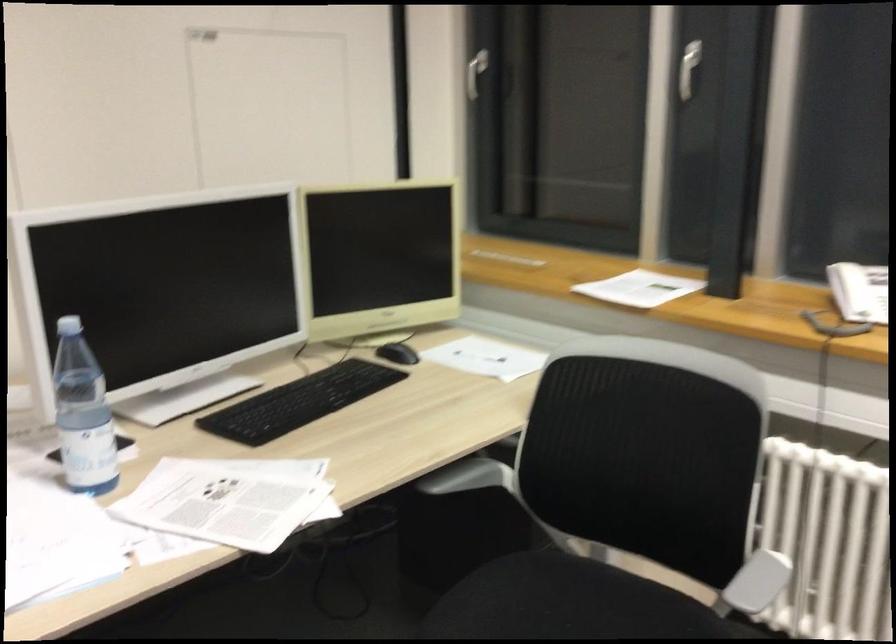
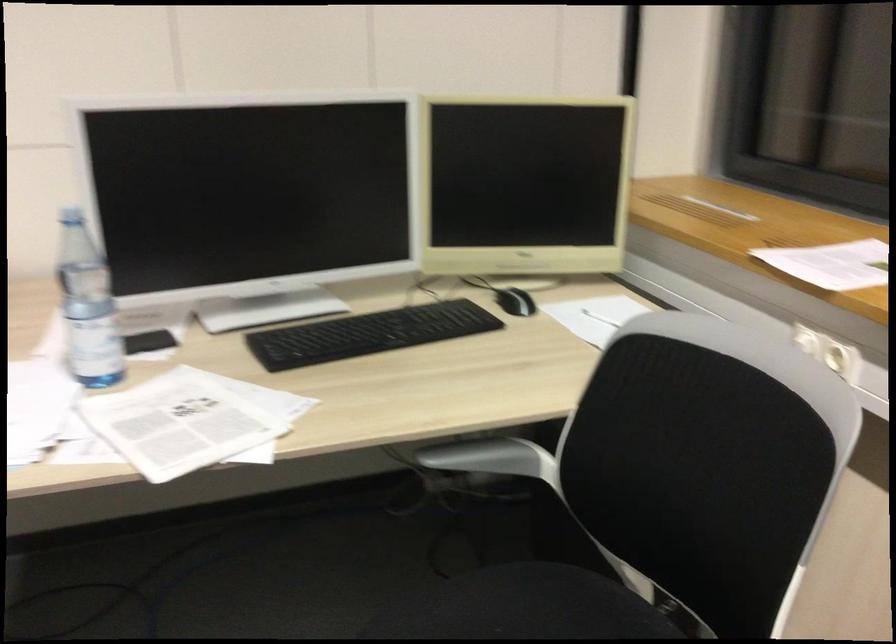
Question: The camera is either moving clockwise (left) or counter-clockwise (right) around the object. The first image is from the beginning of the video and the second image is from the end. Is the camera moving left or right when shooting the video?

Choices:
 (A) Left
 (B) Right

Answer: (B)